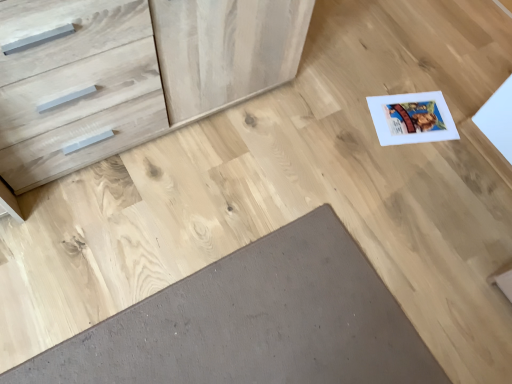
Identify the location of empty space that is in between brown matte doormat at lower center and natural wood chest of drawers at upper left. This screenshot has height=384, width=512. (193, 208).